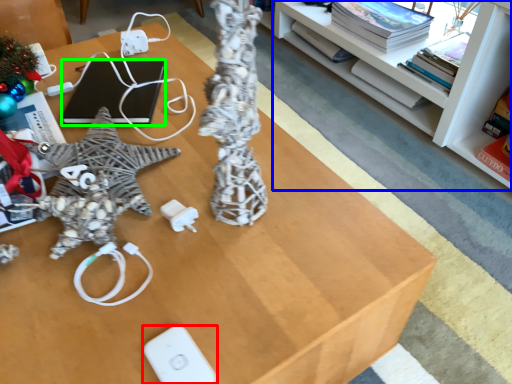
Question: Which object is the closest to the Wii controller (highlighted by a red box)? Choose among these: shelf (highlighted by a blue box) or laptop (highlighted by a green box).

Choices:
 (A) shelf
 (B) laptop

Answer: (B)